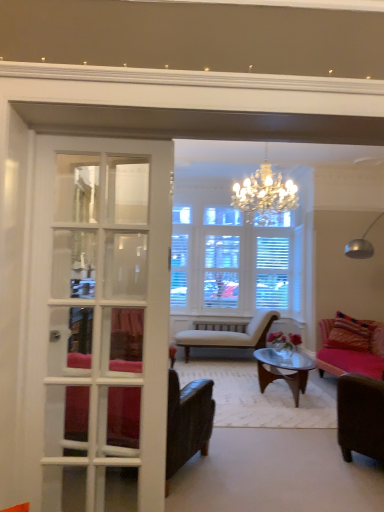
Question: In terms of width, does brown leather chair at lower right, which is counted as the second chair, starting from the back, look wider or thinner when compared to beige striped chaise lounge at center, which ranks as the first chair in back-to-front order?

Choices:
 (A) thin
 (B) wide

Answer: (A)

Question: Considering their positions, is brown leather chair at lower right, marked as the second chair in a front-to-back arrangement, located in front of or behind beige striped chaise lounge at center, placed as the 3th chair when sorted from front to back?

Choices:
 (A) behind
 (B) front

Answer: (B)

Question: Which object is the farthest from the leather armchair at left, the 3th chair viewed from the back?

Choices:
 (A) brown leather chair at lower right, which is counted as the second chair, starting from the back
 (B) white glass door at left
 (C) beige striped chaise lounge at center, placed as the 3th chair when sorted from front to back

Answer: (C)

Question: Estimate the real-world distances between objects in this image. Which object is farther from the white glass door at left?

Choices:
 (A) beige striped chaise lounge at center, placed as the 3th chair when sorted from front to back
 (B) leather armchair at left, the 3th chair viewed from the back
 (C) brown leather chair at lower right, which is counted as the second chair, starting from the back

Answer: (A)